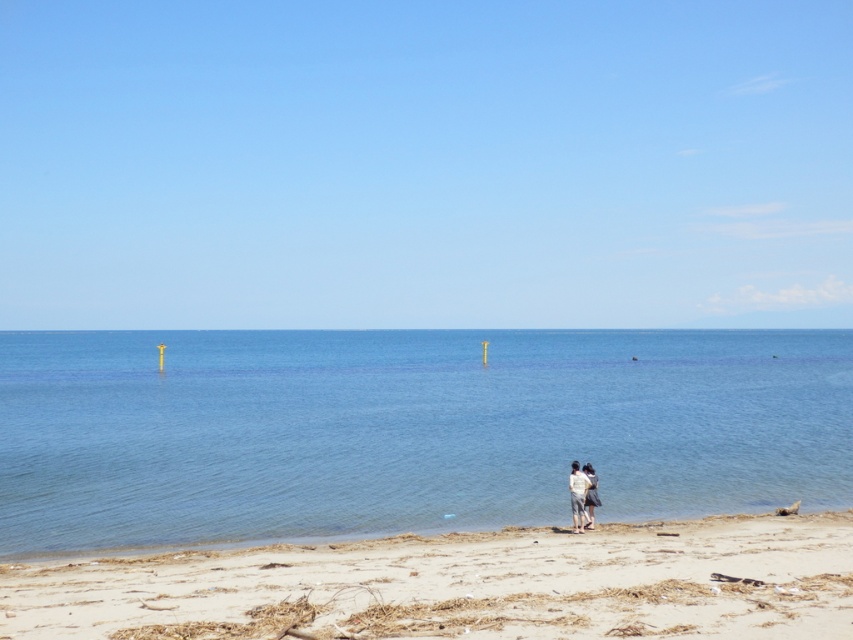
Question: Which point is closer to the camera?

Choices:
 (A) white cotton shirt at center
 (B) light beige sand at lower center

Answer: (B)

Question: Which point is farther from the camera taking this photo?

Choices:
 (A) (65, 353)
 (B) (137, 602)
 (C) (575, 497)
 (D) (595, 474)

Answer: (A)

Question: Considering the relative positions of light beige sand at lower center and light gray cotton shirt at lower center in the image provided, where is light beige sand at lower center located with respect to light gray cotton shirt at lower center?

Choices:
 (A) left
 (B) right

Answer: (A)

Question: Which object appears closest to the camera in this image?

Choices:
 (A) light beige sand at lower center
 (B) white cotton shirt at center

Answer: (A)

Question: Is blue water at center smaller than white cotton shirt at center?

Choices:
 (A) no
 (B) yes

Answer: (A)

Question: Can you confirm if blue water at center is bigger than light beige sand at lower center?

Choices:
 (A) yes
 (B) no

Answer: (A)